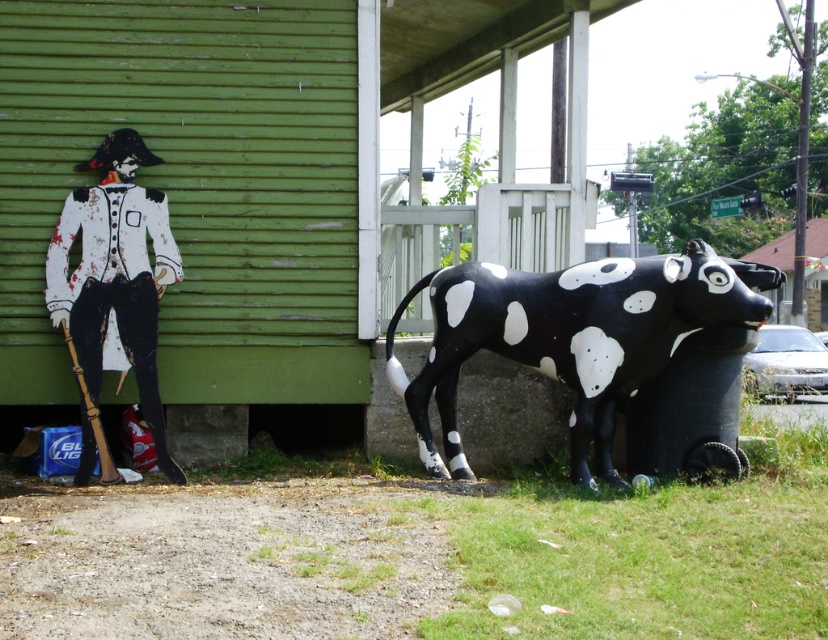
Between point (567, 300) and point (112, 177), which one is positioned in front?

Positioned in front is point (567, 300).

The width and height of the screenshot is (828, 640). In order to click on black glossy plastic bull at lower right in this screenshot , I will do `click(571, 337)`.